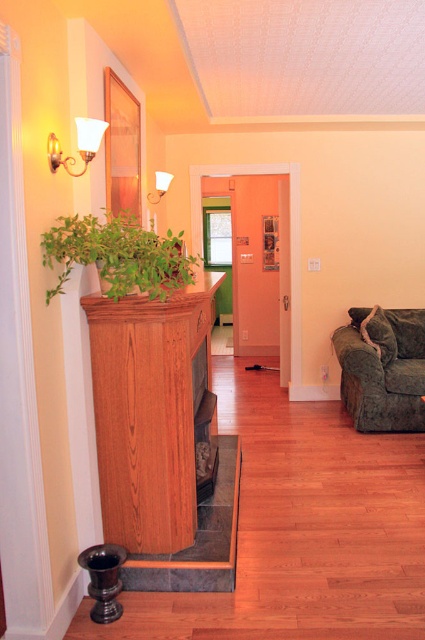
You are planning to move a wide sofa into this living room. The sofa you want to move is as wide as the velvet green couch at lower right. There is a narrow hallway leading to this room that is only as wide as the wooden fireplace at left. Will the sofa fit through the hallway?

The wooden fireplace at left is thinner than the velvet green couch at lower right. Since the hallway is as wide as the fireplace, the sofa, which is as wide as the velvet green couch at lower right, will not fit through the hallway because it is wider than the fireplace.

You are planning to rearrange the furniture in the living room. The wooden fireplace at left is currently taking up more space than the velvet green couch at lower right. If you want to move the velvet green couch closer to the fireplace, will the space between them be enough for you to walk through comfortably?

The wooden fireplace at left is bigger than the velvet green couch at lower right, so there might be sufficient space between them for comfortable passage. However, since the exact distance isn

In the cozy living room scene, there is a dark wood fireplace at center and a matte white wall sconce at upper left. Which object takes up more space in the image?

The dark wood fireplace at center is bigger than the matte white wall sconce at upper left, so it takes up more space in the image.